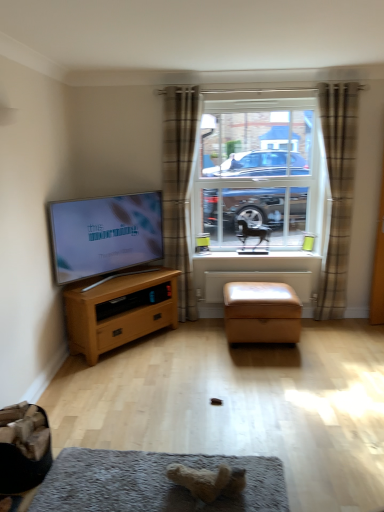
Image resolution: width=384 pixels, height=512 pixels. Identify the location of space that is in front of satin tan ottoman at center. (283, 370).